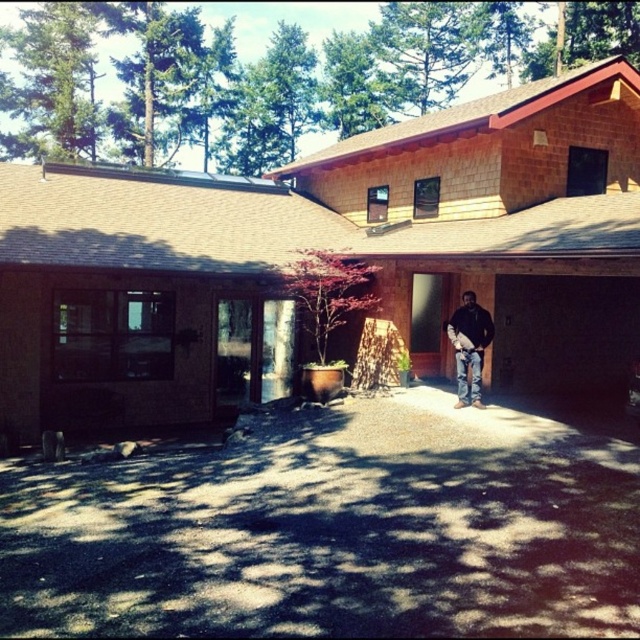
You are a delivery person trying to park your van in front of the house. The van requires a flat, open space. Based on the image, is the dark asphalt driveway at center suitable for parking?

The dark asphalt driveway at center is located at point (336, 531), which is the center area, so it is suitable for parking the van as it provides a flat and open space.

Imagine you are standing at the entrance of the modern house and looking towards the driveway. There is a point marked at coordinates point [326,250]. What material does this point indicate?

The point [326,250] marks brown shingles at center.